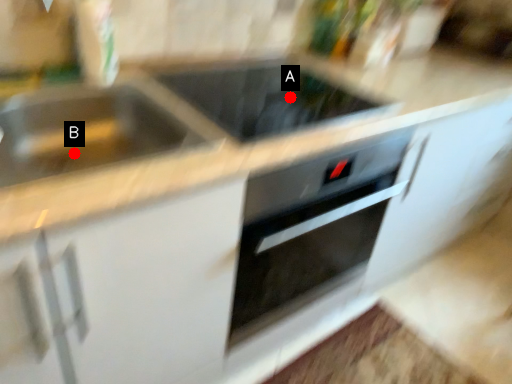
Question: Two points are circled on the image, labeled by A and B beside each circle. Which point is closer to the camera?

Choices:
 (A) A is closer
 (B) B is closer

Answer: (B)